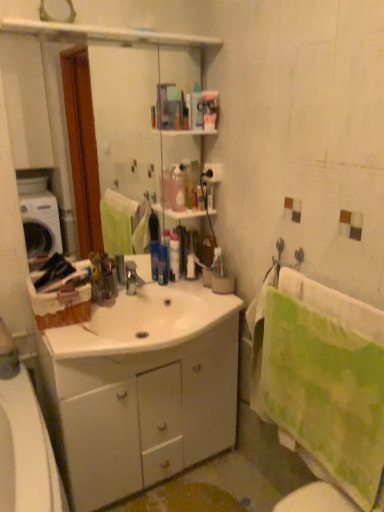
The width and height of the screenshot is (384, 512). Identify the location of free spot to the right of metallic silver faucet at center. (161, 301).